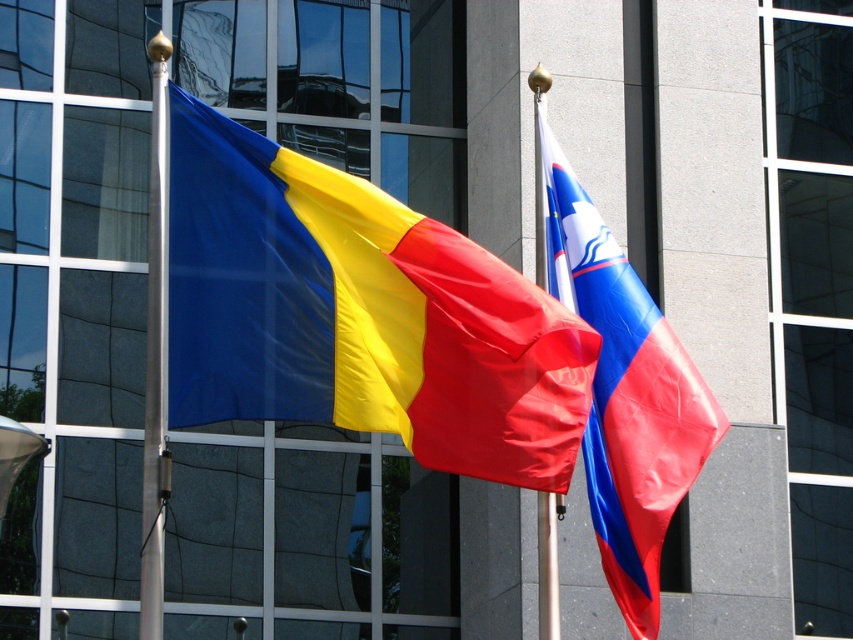
Question: Does silky fabric flag at left appear under metallic silver flag pole at center?

Choices:
 (A) yes
 (B) no

Answer: (B)

Question: Which of these objects is positioned closest to the metallic silver flag pole at center?

Choices:
 (A) silky fabric flag at left
 (B) polished metal flag pole at left

Answer: (A)

Question: Is silky fabric flag at left below polished metal flag pole at left?

Choices:
 (A) no
 (B) yes

Answer: (A)

Question: Is silky fabric flag at left closer to camera compared to polished metal flag pole at left?

Choices:
 (A) yes
 (B) no

Answer: (A)

Question: Which is nearer to the blue and white fabric flag at center?

Choices:
 (A) polished metal flag pole at left
 (B) metallic silver flag pole at center

Answer: (B)

Question: Estimate the real-world distances between objects in this image. Which object is closer to the metallic silver flag pole at center?

Choices:
 (A) blue and white fabric flag at center
 (B) polished metal flag pole at left
 (C) silky fabric flag at left

Answer: (A)